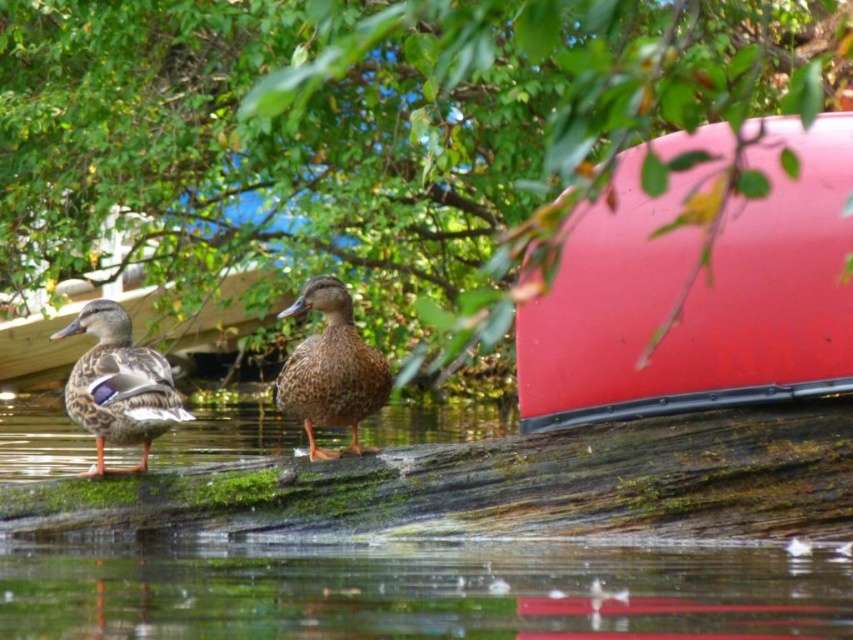
Can you confirm if green leafy tree at upper center is taller than transparent water at lower center?

Correct, green leafy tree at upper center is much taller as transparent water at lower center.

Describe the element at coordinates (257, 148) in the screenshot. I see `green leafy tree at upper center` at that location.

Locate an element on the screen. green leafy tree at upper center is located at coordinates (257, 148).

Which is below, rubberized red canoe at upper right or brown matte duck at center?

brown matte duck at center is below.

Measure the distance between rubberized red canoe at upper right and brown matte duck at center.

A distance of 3.61 feet exists between rubberized red canoe at upper right and brown matte duck at center.

What do you see at coordinates (698, 294) in the screenshot? I see `rubberized red canoe at upper right` at bounding box center [698, 294].

Where is `rubberized red canoe at upper right`? The image size is (853, 640). rubberized red canoe at upper right is located at coordinates click(698, 294).

Does green leafy tree at upper center appear on the left side of brown matte duck at left?

Yes, green leafy tree at upper center is to the left of brown matte duck at left.

Is green leafy tree at upper center positioned in front of brown matte duck at left?

That is False.

Between point (181, 275) and point (148, 371), which one is positioned in front?

Point (148, 371) is more forward.

In order to click on green leafy tree at upper center in this screenshot , I will do `click(257, 148)`.